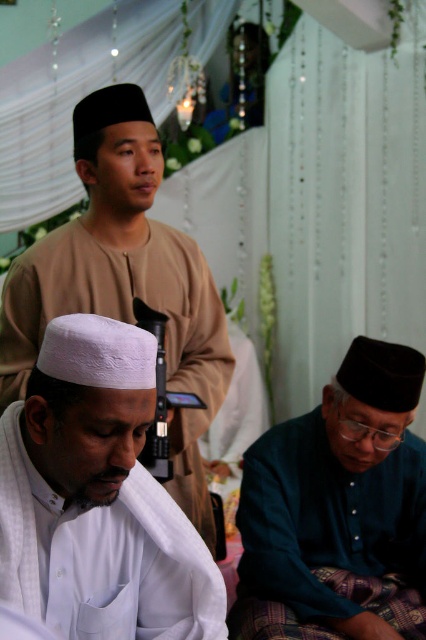
You are an observer in the scene. You see the white matte cap at center and the dark blue fabric at lower right. Which object is closer to you?

The white matte cap at center is closer to you because it is in front of the dark blue fabric at lower right.

Based on the coordinates provided, which object is located at point (97,497)?

The white matte cap at center is located at point (97,497).